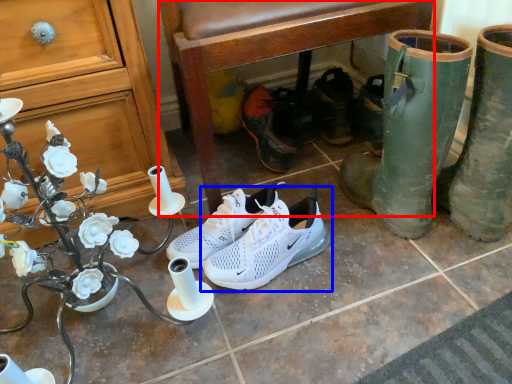
Question: Among these objects, which one is farthest to the camera, chair (highlighted by a red box) or footwear (highlighted by a blue box)?

Choices:
 (A) chair
 (B) footwear

Answer: (B)